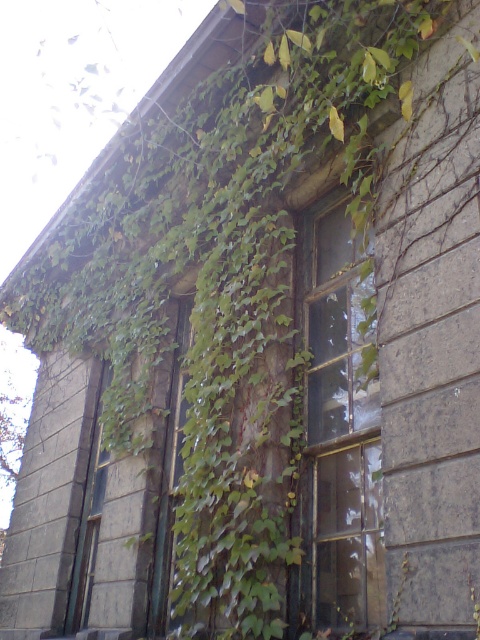
You are a painter hired to paint the building. You need to decide which object, the transparent glass window at center or the green mossy door at center, requires more paint because it has a larger surface area. Which one do you choose?

The transparent glass window at center has a larger size compared to the green mossy door at center, so you should choose to paint the transparent glass window at center because it has a larger surface area and thus requires more paint.

You are standing in front of the stone building covered with ivy. You need to locate the transparent glass window at center. Where is it positioned in terms of coordinates?

The transparent glass window at center is positioned at coordinates point (x=336, y=432).

You are a painter hired to paint the facade of this stone building. You need to decide which object, the transparent glass window at center or the green mossy door at center, requires more ladder height to reach its top edge. Based on the scene description, which one would need a taller ladder?

The transparent glass window at center is much taller than the green mossy door at center, so the transparent glass window at center requires a taller ladder to reach its top edge.